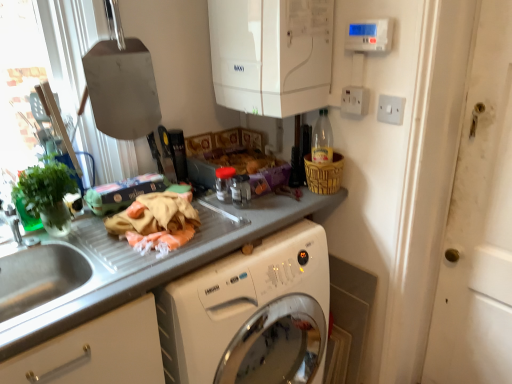
Question: From a real-world perspective, is smooth gray countertop at center positioned above or below white plastic switch at upper right, acting as the 2th electric outlet starting from the left?

Choices:
 (A) above
 (B) below

Answer: (B)

Question: Is smooth gray countertop at center inside or outside of white plastic switch at upper right, placed as the 1th electric outlet when sorted from right to left?

Choices:
 (A) inside
 (B) outside

Answer: (B)

Question: Considering the real-world distances, which object is farthest from the white plastic electric outlet at upper right, positioned as the 2th electric outlet in right-to-left order?

Choices:
 (A) woven brown basket at upper right
 (B) metallic silver spatula at upper left, placed as the third appliance when sorted from right to left
 (C) green matte plant at left
 (D) brushed metal faucet at left
 (E) smooth gray countertop at center

Answer: (D)

Question: Considering the real-world distances, which object is farthest from the woven brown basket at upper right?

Choices:
 (A) white glossy boiler at upper center, which appears as the third appliance when viewed from the left
 (B) white plastic electric outlet at upper right, the 1th electric outlet viewed from the left
 (C) brushed metal faucet at left
 (D) transparent plastic spice jar at center, which is counted as the 2th appliance, starting from the left
 (E) smooth gray countertop at center

Answer: (C)